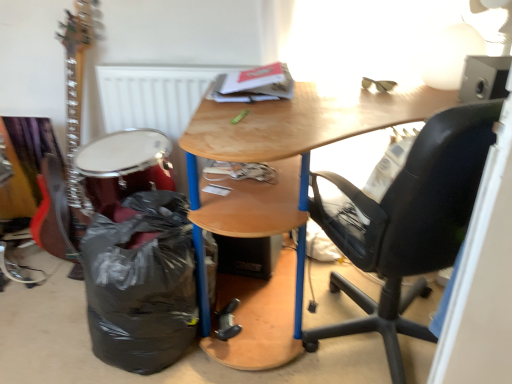
Question: From the image's perspective, is shiny red drum at lower left above black plastic bag at lower left?

Choices:
 (A) yes
 (B) no

Answer: (A)

Question: Considering the relative positions of shiny red drum at lower left and black plastic bag at lower left in the image provided, is shiny red drum at lower left to the right of black plastic bag at lower left from the viewer's perspective?

Choices:
 (A) yes
 (B) no

Answer: (B)

Question: Is shiny red drum at lower left beside black plastic bag at lower left?

Choices:
 (A) yes
 (B) no

Answer: (B)

Question: Is shiny red drum at lower left bigger than black plastic bag at lower left?

Choices:
 (A) yes
 (B) no

Answer: (B)

Question: From a real-world perspective, is shiny red drum at lower left under black plastic bag at lower left?

Choices:
 (A) yes
 (B) no

Answer: (B)

Question: Is shiny red drum at lower left to the left of black plastic bag at lower left from the viewer's perspective?

Choices:
 (A) no
 (B) yes

Answer: (B)

Question: Considering the relative sizes of black leather office chair at right and wooden desk at center in the image provided, is black leather office chair at right thinner than wooden desk at center?

Choices:
 (A) yes
 (B) no

Answer: (A)

Question: Considering the relative sizes of black leather office chair at right and wooden desk at center in the image provided, is black leather office chair at right taller than wooden desk at center?

Choices:
 (A) no
 (B) yes

Answer: (B)

Question: Is black leather office chair at right beside wooden desk at center?

Choices:
 (A) no
 (B) yes

Answer: (A)

Question: Could you tell me if black leather office chair at right is facing wooden desk at center?

Choices:
 (A) no
 (B) yes

Answer: (B)

Question: From a real-world perspective, is black leather office chair at right on top of wooden desk at center?

Choices:
 (A) no
 (B) yes

Answer: (B)

Question: From the image's perspective, does black leather office chair at right appear lower than wooden desk at center?

Choices:
 (A) no
 (B) yes

Answer: (B)

Question: From the image's perspective, is black leather office chair at right below white matte radiator at upper center?

Choices:
 (A) yes
 (B) no

Answer: (A)